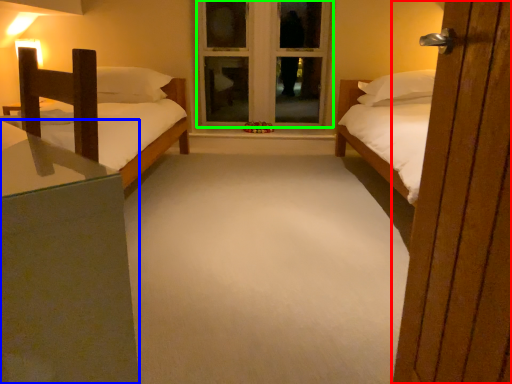
Question: Based on their relative distances, which object is nearer to door (highlighted by a red box)? Choose from nightstand (highlighted by a blue box) and window frame (highlighted by a green box).

Choices:
 (A) nightstand
 (B) window frame

Answer: (A)